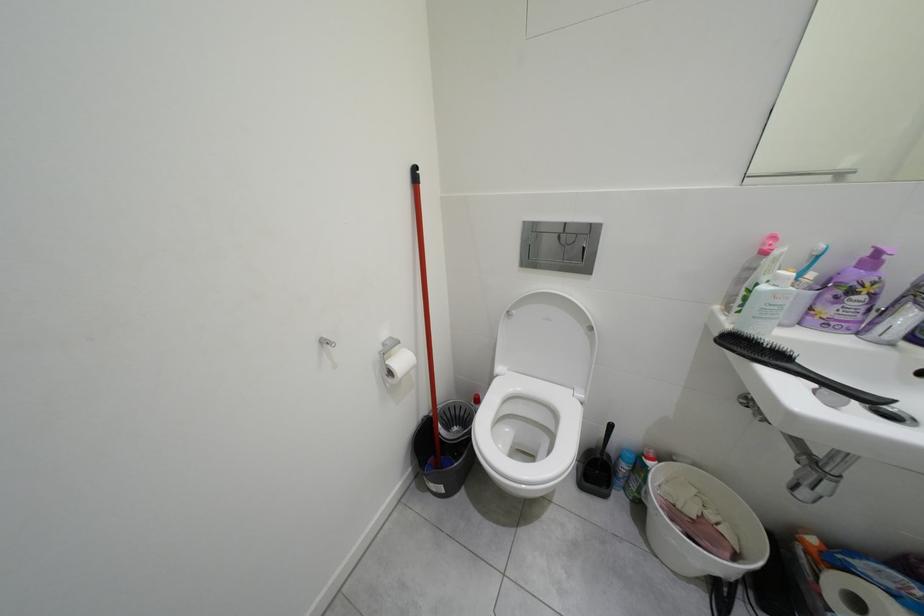
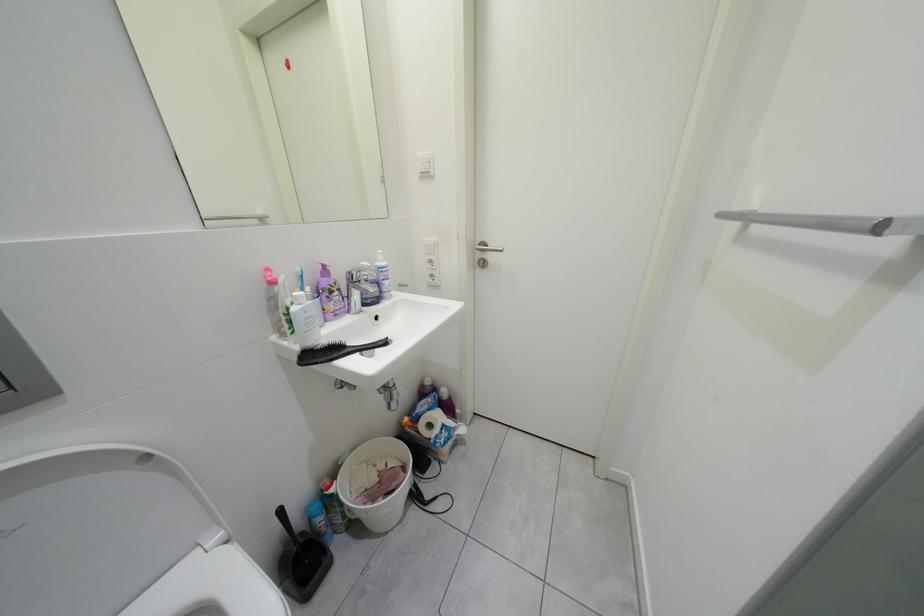
The images are taken continuously from a first-person perspective. In which direction is your viewpoint rotating?

The rotation direction of the camera is right-down.